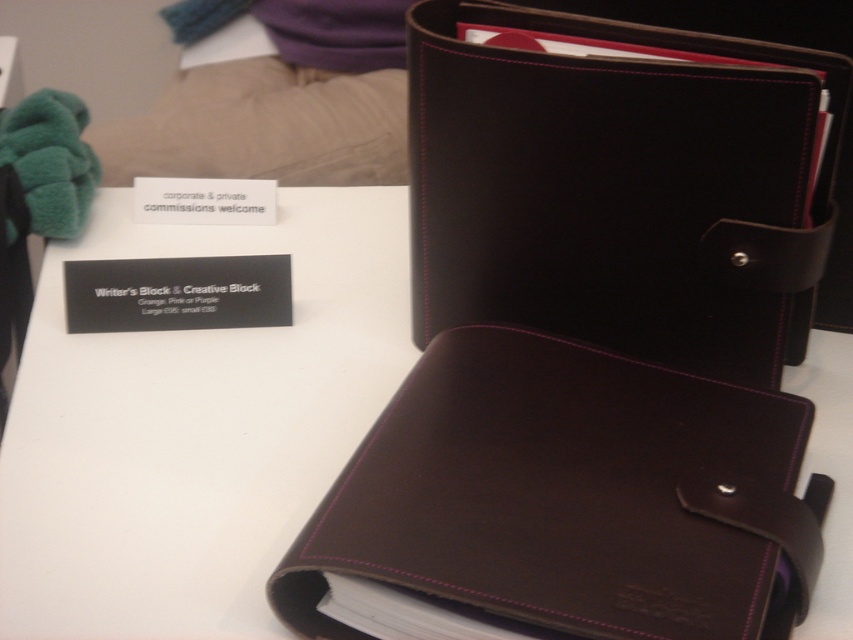
Is point (579, 122) closer to camera compared to point (328, 625)?

No, it is not.

The height and width of the screenshot is (640, 853). Find the location of `dark brown leather binder at center`. dark brown leather binder at center is located at coordinates (616, 186).

From the picture: Is brown leather wallet at center in front of brown leather folder at center?

No, brown leather wallet at center is further to the viewer.

From the picture: Can you confirm if brown leather wallet at center is positioned below brown leather folder at center?

Actually, brown leather wallet at center is above brown leather folder at center.

At what (x,y) coordinates should I click in order to perform the action: click on brown leather wallet at center. Please return your answer as a coordinate pair (x, y). This screenshot has width=853, height=640. Looking at the image, I should click on (194, 424).

Between brown leather wallet at center and dark brown leather binder at center, which one is positioned lower?

Positioned lower is brown leather wallet at center.

Is brown leather wallet at center wider than dark brown leather binder at center?

Correct, the width of brown leather wallet at center exceeds that of dark brown leather binder at center.

Image resolution: width=853 pixels, height=640 pixels. I want to click on brown leather wallet at center, so click(194, 424).